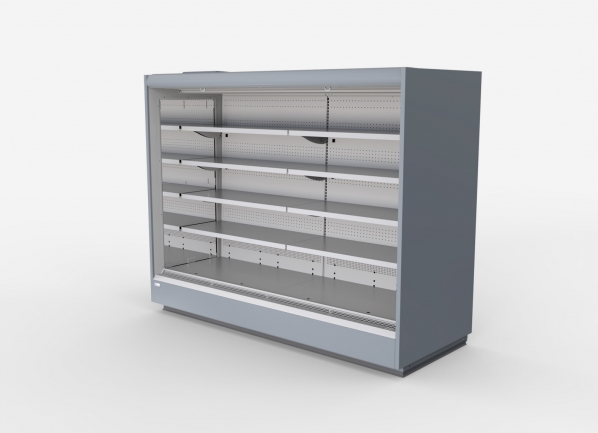
At what (x,y) coordinates should I click in order to perform the action: click on the top of cabinet. Please return your answer as a coordinate pair (x, y). The height and width of the screenshot is (433, 598). Looking at the image, I should click on (270, 77).